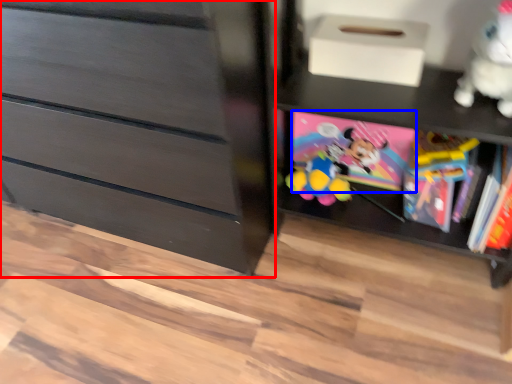
Question: Which object is further to the camera taking this photo, chest of drawers (highlighted by a red box) or book (highlighted by a blue box)?

Choices:
 (A) chest of drawers
 (B) book

Answer: (B)